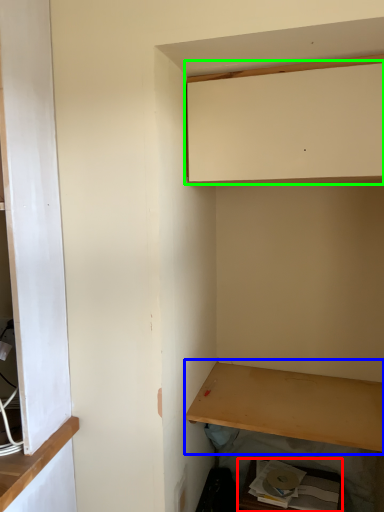
Question: Estimate the real-world distances between objects in this image. Which object is closer to cabinetry (highlighted by a red box), shelf (highlighted by a blue box) or cabinetry (highlighted by a green box)?

Choices:
 (A) shelf
 (B) cabinetry

Answer: (A)